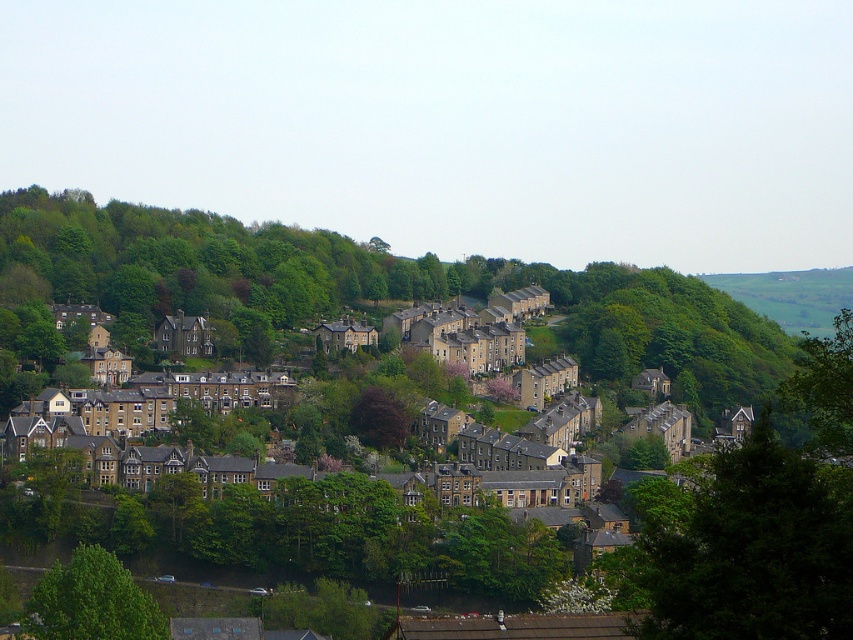
Question: Can you confirm if green leafy tree at center is positioned to the left of dark brown textured tree at center?

Choices:
 (A) no
 (B) yes

Answer: (A)

Question: Is green leafy tree at center to the right of green leafy tree at lower left from the viewer's perspective?

Choices:
 (A) no
 (B) yes

Answer: (B)

Question: Which is nearer to the green leafy tree at center?

Choices:
 (A) green leafy tree at lower left
 (B) dark brown textured tree at center

Answer: (A)

Question: Can you confirm if green leafy tree at lower left is positioned above dark brown textured tree at center?

Choices:
 (A) no
 (B) yes

Answer: (A)

Question: Considering the real-world distances, which object is closest to the green leafy tree at center?

Choices:
 (A) dark brown textured tree at center
 (B) green leafy tree at lower left

Answer: (B)

Question: Which is farther from the dark brown textured tree at center?

Choices:
 (A) green leafy tree at lower left
 (B) green leafy tree at center

Answer: (B)